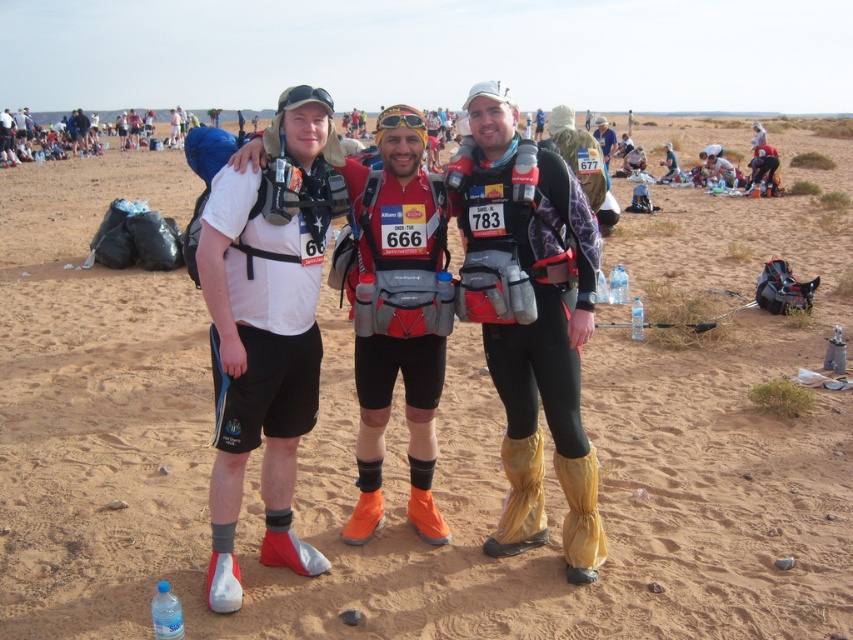
Question: Which point is farther to the camera?

Choices:
 (A) (238, 445)
 (B) (399, 109)
 (C) (596, 259)

Answer: (C)

Question: Which object is farther from the camera taking this photo?

Choices:
 (A) matte black pants at center
 (B) white matte shorts at center
 (C) shiny gold sunglasses at center

Answer: (C)

Question: Does white matte shorts at center have a lesser width compared to shiny gold sunglasses at center?

Choices:
 (A) yes
 (B) no

Answer: (B)

Question: Which object is farther from the camera taking this photo?

Choices:
 (A) white matte shorts at center
 (B) shiny gold sunglasses at center

Answer: (B)

Question: Does matte black pants at center appear on the right side of white matte shorts at center?

Choices:
 (A) yes
 (B) no

Answer: (A)

Question: Can you confirm if white matte shorts at center is thinner than shiny gold sunglasses at center?

Choices:
 (A) yes
 (B) no

Answer: (B)